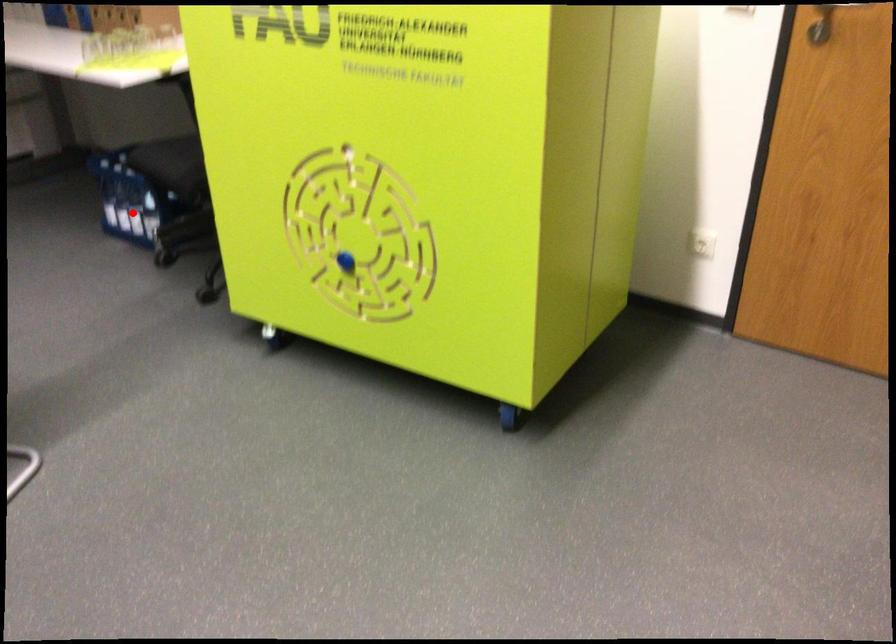
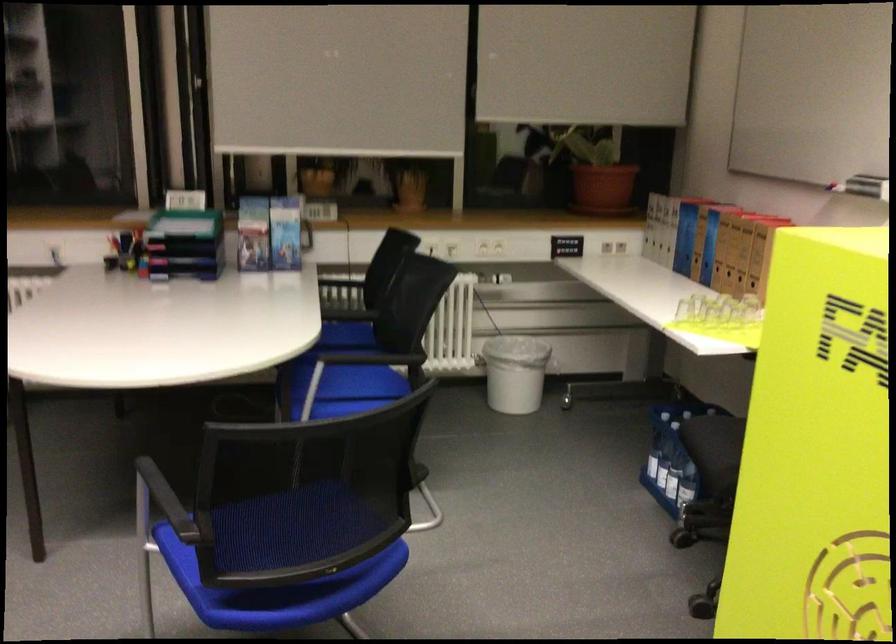
In the second image, find the point that corresponds to the highlighted location in the first image.

(667, 471)